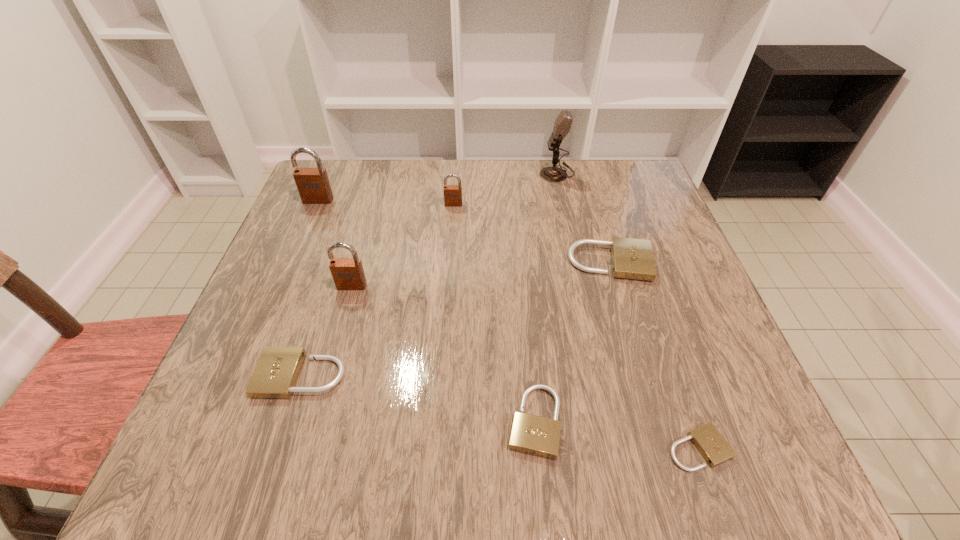
I want to click on free spot between the second brown padlock from left to right and the farthest object, so click(454, 230).

This screenshot has height=540, width=960. I want to click on blank region between the shortest object and the fifth object from right to left, so click(x=576, y=326).

Locate an element on the screen. Image resolution: width=960 pixels, height=540 pixels. blank region between the seventh tallest object and the microphone is located at coordinates (545, 297).

At what (x,y) coordinates should I click in order to perform the action: click on vacant area that lies between the second tallest object and the tallest object. Please return your answer as a coordinate pair (x, y). The width and height of the screenshot is (960, 540). Looking at the image, I should click on (438, 186).

Image resolution: width=960 pixels, height=540 pixels. In order to click on object that is the sixth closest one to the tallest object in this screenshot , I will do `click(275, 375)`.

Find the location of `object that is the second closest to the leftmost brown padlock`. object that is the second closest to the leftmost brown padlock is located at coordinates (452, 193).

This screenshot has height=540, width=960. What are the coordinates of `the second closest padlock relative to the microphone` in the screenshot? It's located at (632, 258).

At what (x,y) coordinates should I click in order to perform the action: click on the fourth closest padlock relative to the rightmost brown padlock. Please return your answer as a coordinate pair (x, y). The height and width of the screenshot is (540, 960). Looking at the image, I should click on (x=275, y=375).

Identify which brown padlock is the closest to the fourth shortest padlock. Please provide its 2D coordinates. Your answer should be formatted as a tuple, i.e. [(x, y)], where the tuple contains the x and y coordinates of a point satisfying the conditions above.

[(452, 193)]

Where is `brown padlock that can be found as the second closest to the nearest brown padlock`? The width and height of the screenshot is (960, 540). brown padlock that can be found as the second closest to the nearest brown padlock is located at coordinates (452, 193).